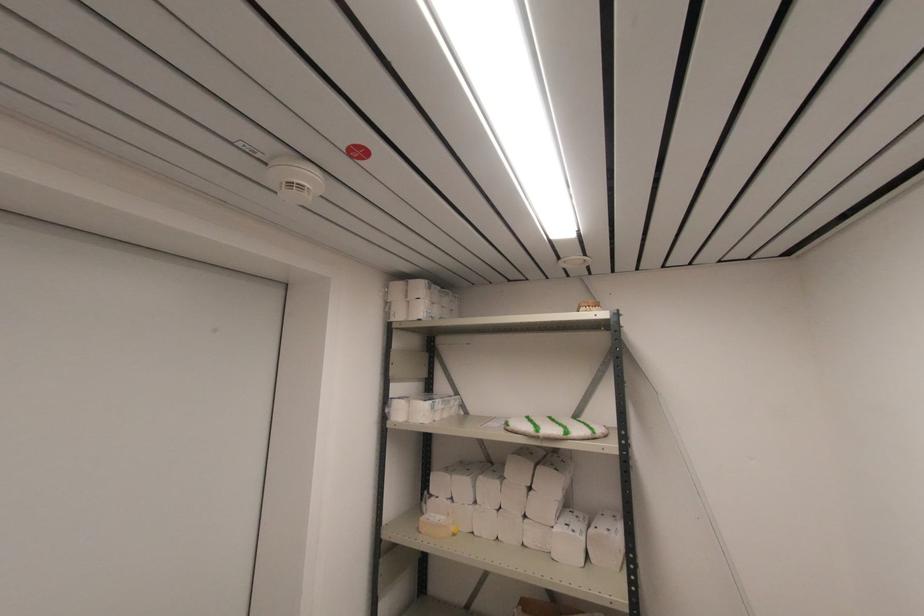
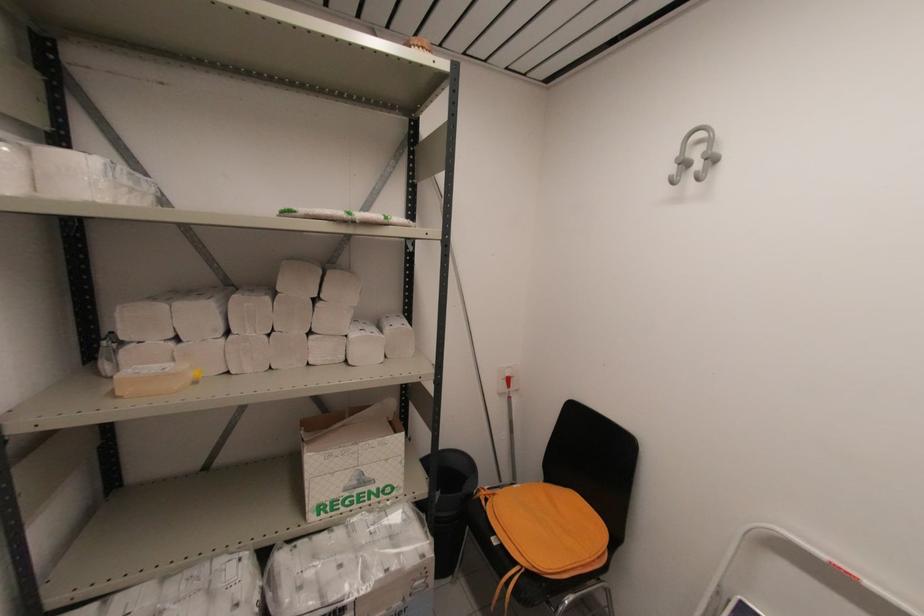
First-person continuous shooting, in which direction is the camera rotating?

The camera's rotation is toward right-down.